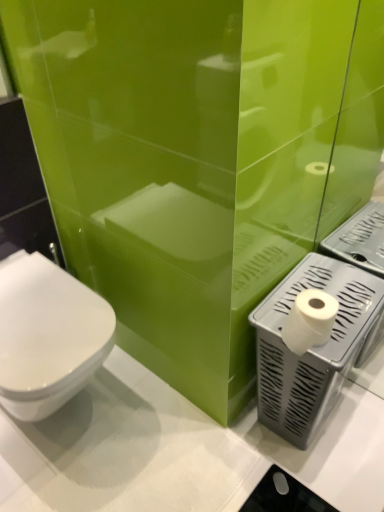
The height and width of the screenshot is (512, 384). Find the location of `white glossy toilet at left`. white glossy toilet at left is located at coordinates (47, 335).

Locate an element on the screen. The width and height of the screenshot is (384, 512). gray plastic toilet paper holder at lower right is located at coordinates (313, 347).

Considering the positions of points (306, 311) and (342, 269), is point (306, 311) closer to camera compared to point (342, 269)?

Yes, point (306, 311) is in front of point (342, 269).

From the image's perspective, between white matte toilet paper at right and gray plastic toilet paper holder at lower right, who is located below?

gray plastic toilet paper holder at lower right.

Who is bigger, white matte toilet paper at right or gray plastic toilet paper holder at lower right?

gray plastic toilet paper holder at lower right is bigger.

Is gray plastic toilet paper holder at lower right surrounded by white matte toilet paper at right?

That's incorrect, gray plastic toilet paper holder at lower right is not inside white matte toilet paper at right.

Is white glossy toilet at left next to gray plastic toilet paper holder at lower right?

No, white glossy toilet at left is not making contact with gray plastic toilet paper holder at lower right.

Does white glossy toilet at left lie in front of gray plastic toilet paper holder at lower right?

Yes.

Does white glossy toilet at left appear on the left side of gray plastic toilet paper holder at lower right?

Correct, you'll find white glossy toilet at left to the left of gray plastic toilet paper holder at lower right.

Between gray plastic toilet paper holder at lower right and white glossy toilet at left, which one has more height?

Standing taller between the two is gray plastic toilet paper holder at lower right.

Which is more to the left, gray plastic toilet paper holder at lower right or white glossy toilet at left?

Positioned to the left is white glossy toilet at left.

Between gray plastic toilet paper holder at lower right and white glossy toilet at left, which one has smaller width?

With smaller width is gray plastic toilet paper holder at lower right.

Is gray plastic toilet paper holder at lower right facing away from white glossy toilet at left?

gray plastic toilet paper holder at lower right does not have its back to white glossy toilet at left.

Who is shorter, white glossy toilet at left or white matte toilet paper at right?

white matte toilet paper at right is shorter.

Is white glossy toilet at left facing towards white matte toilet paper at right?

No, white glossy toilet at left is not aimed at white matte toilet paper at right.

Is white glossy toilet at left with white matte toilet paper at right?

white glossy toilet at left is not next to white matte toilet paper at right, and they're not touching.

Is gray plastic toilet paper holder at lower right touching white matte toilet paper at right?

gray plastic toilet paper holder at lower right and white matte toilet paper at right are clearly separated.

Considering the relative sizes of gray plastic toilet paper holder at lower right and white matte toilet paper at right in the image provided, is gray plastic toilet paper holder at lower right taller than white matte toilet paper at right?

Indeed, gray plastic toilet paper holder at lower right has a greater height compared to white matte toilet paper at right.

Is gray plastic toilet paper holder at lower right positioned with its back to white matte toilet paper at right?

gray plastic toilet paper holder at lower right does not have its back to white matte toilet paper at right.

Considering the positions of objects gray plastic toilet paper holder at lower right and white matte toilet paper at right in the image provided, who is more to the right, gray plastic toilet paper holder at lower right or white matte toilet paper at right?

Positioned to the right is gray plastic toilet paper holder at lower right.

Is white matte toilet paper at right taller or shorter than white glossy toilet at left?

Clearly, white matte toilet paper at right is shorter compared to white glossy toilet at left.

From the image's perspective, is white matte toilet paper at right on white glossy toilet at left?

Yes, from the image's perspective, white matte toilet paper at right is on top of white glossy toilet at left.

Which object is positioned more to the right, white matte toilet paper at right or white glossy toilet at left?

Positioned to the right is white matte toilet paper at right.

Are white matte toilet paper at right and white glossy toilet at left located far from each other?

No, there isn't a large distance between white matte toilet paper at right and white glossy toilet at left.

Find the location of a particular element. The width and height of the screenshot is (384, 512). toilet paper located on the left of gray plastic toilet paper holder at lower right is located at coordinates (309, 320).

You are a GUI agent. You are given a task and a screenshot of the screen. Output one action in this format:
    pyautogui.click(x=<x>, y=<y>)
    Task: Click on the toilet in front of the gray plastic toilet paper holder at lower right
    
    Given the screenshot: What is the action you would take?
    pyautogui.click(x=47, y=335)

Which object lies further to the anchor point white matte toilet paper at right, white glossy toilet at left or gray plastic toilet paper holder at lower right?

white glossy toilet at left.

From the image, which object appears to be farther from white matte toilet paper at right, gray plastic toilet paper holder at lower right or white glossy toilet at left?

Based on the image, white glossy toilet at left appears to be further to white matte toilet paper at right.

From the image, which object appears to be nearer to white glossy toilet at left, gray plastic toilet paper holder at lower right or white matte toilet paper at right?

Based on the image, gray plastic toilet paper holder at lower right appears to be nearer to white glossy toilet at left.

Considering their positions, is white glossy toilet at left positioned closer to gray plastic toilet paper holder at lower right than white matte toilet paper at right?

Based on the image, white matte toilet paper at right appears to be nearer to gray plastic toilet paper holder at lower right.

Estimate the real-world distances between objects in this image. Which object is closer to gray plastic toilet paper holder at lower right, white matte toilet paper at right or white glossy toilet at left?

white matte toilet paper at right.

Considering their positions, is white matte toilet paper at right positioned further to white glossy toilet at left than gray plastic toilet paper holder at lower right?

Based on the image, white matte toilet paper at right appears to be further to white glossy toilet at left.

Identify the location of toilet paper located between white glossy toilet at left and gray plastic toilet paper holder at lower right in the left-right direction. Image resolution: width=384 pixels, height=512 pixels. (309, 320).